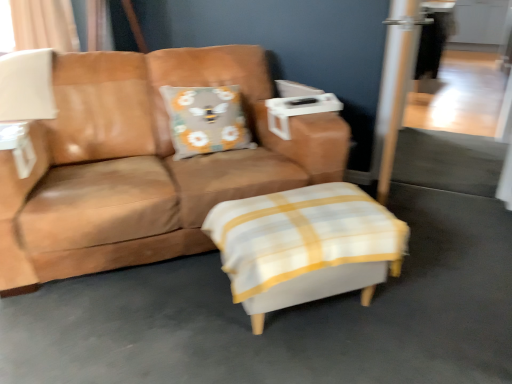
Question: Looking at the image, does white matte table lamp at upper left seem bigger or smaller compared to brown leather couch at center?

Choices:
 (A) big
 (B) small

Answer: (B)

Question: Considering the positions of white matte table lamp at upper left and brown leather couch at center in the image, is white matte table lamp at upper left wider or thinner than brown leather couch at center?

Choices:
 (A) thin
 (B) wide

Answer: (A)

Question: Which object is the farthest from the white fabric ottoman at center?

Choices:
 (A) white matte table lamp at upper left
 (B) gray fabric pillow with bee design at center
 (C) beige fabric curtain at upper left
 (D) brown leather couch at center
 (E) transparent glass screen door at upper right

Answer: (C)

Question: Estimate the real-world distances between objects in this image. Which object is closer to the white matte table lamp at upper left?

Choices:
 (A) gray fabric pillow with bee design at center
 (B) transparent glass screen door at upper right
 (C) white fabric ottoman at center
 (D) brown leather couch at center
 (E) beige fabric curtain at upper left

Answer: (D)